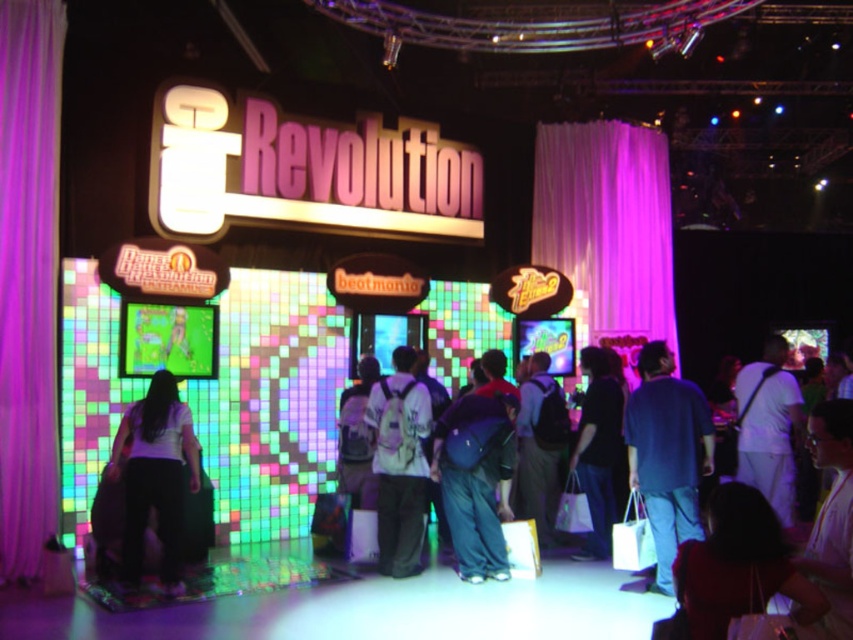
You are an attendee at the event and want to check your belongings before leaving. You notice a white fabric backpack at center and a dark matte shirt at center. Which item is positioned higher on your body?

The white fabric backpack at center is located above the dark matte shirt at center, so the backpack is positioned higher on your body.

You are an event organizer at the Revolution booth and need to place a promotional banner. The banner requires a clear space of 1 meter in front of it. Is there enough space in front of the white fabric backpack at center to place the banner?

The white fabric backpack at center is located at point (399, 464), so there is sufficient space in front of it to place the promotional banner as the banner requires 1 meter of clear space.